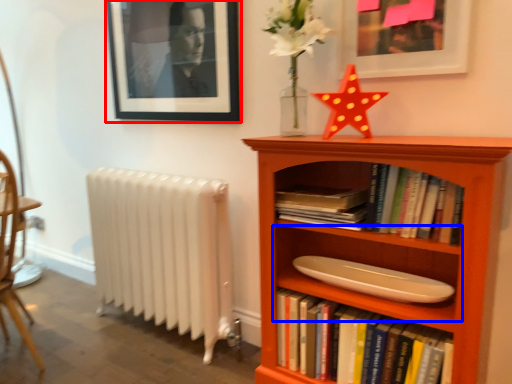
Question: Among these objects, which one is farthest to the camera, picture frame (highlighted by a red box) or shelf (highlighted by a blue box)?

Choices:
 (A) picture frame
 (B) shelf

Answer: (A)